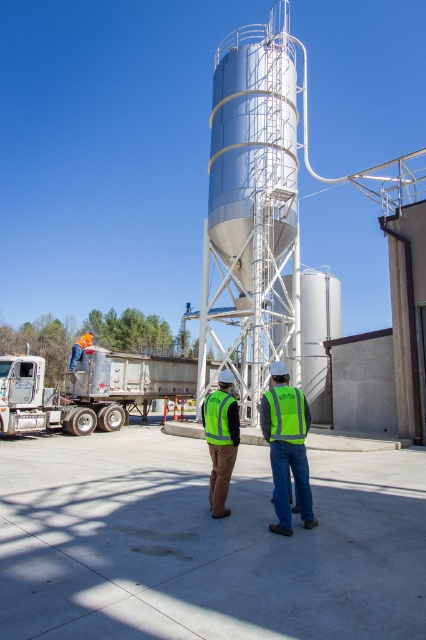
Question: In this image, where is white metallic trailer truck at lower left located relative to green reflective safety vest at center?

Choices:
 (A) right
 (B) left

Answer: (B)

Question: Which point is farther from the camera taking this photo?

Choices:
 (A) (80, 344)
 (B) (227, 444)

Answer: (A)

Question: Among these points, which one is farthest from the camera?

Choices:
 (A) (80, 356)
 (B) (218, 417)
 (C) (218, 404)

Answer: (A)

Question: Does green reflective vest at center have a smaller size compared to green reflective safety vest at lower right?

Choices:
 (A) yes
 (B) no

Answer: (A)

Question: Is green reflective safety vest at lower right to the right of green reflective safety vest at center from the viewer's perspective?

Choices:
 (A) no
 (B) yes

Answer: (B)

Question: Estimate the real-world distances between objects in this image. Which object is farther from the orange hard hat at lower left?

Choices:
 (A) neon yellow vest at center
 (B) white metallic trailer truck at lower left
 (C) smooth metallic water tower at center
 (D) green reflective safety vest at center

Answer: (C)